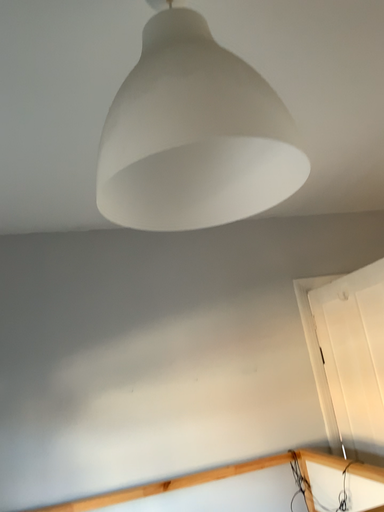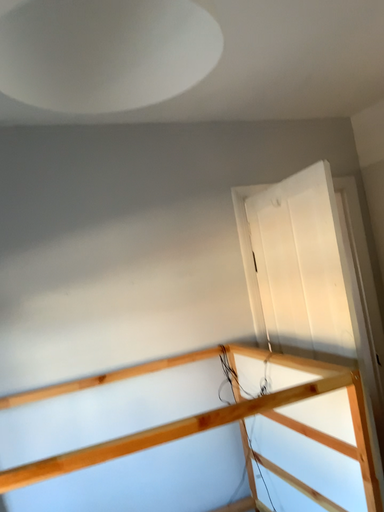
Question: Which way did the camera rotate in the video?

Choices:
 (A) rotated upward
 (B) rotated downward

Answer: (B)